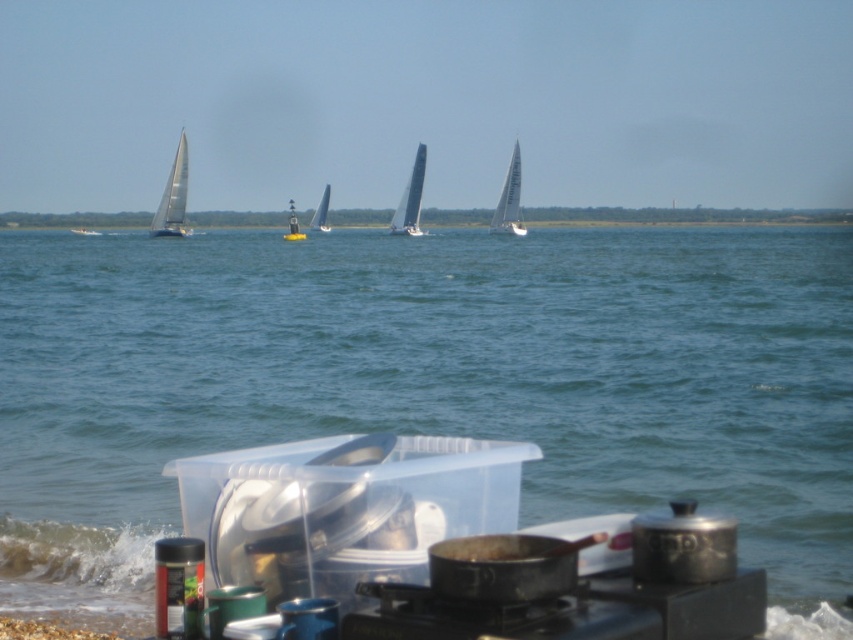
Question: Is black matte stove at lower center further to the viewer compared to white sailboat at left?

Choices:
 (A) no
 (B) yes

Answer: (A)

Question: Does white sail at left appear under white sail at center?

Choices:
 (A) no
 (B) yes

Answer: (B)

Question: Which object is the farthest from the white sail at left?

Choices:
 (A) blue water at center
 (B) black matte stove at lower center
 (C) white sailboat at left

Answer: (B)

Question: Which point is closer to the camera taking this photo?

Choices:
 (A) (90, 234)
 (B) (293, 221)
 (C) (724, 589)

Answer: (C)

Question: Considering the real-world distances, which object is closest to the black matte stove at lower center?

Choices:
 (A) white sail at center
 (B) blue water at center
 (C) clear plastic container at center
 (D) white sailboat at right

Answer: (C)

Question: Can you confirm if clear plastic container at center is smaller than white sail at left?

Choices:
 (A) yes
 (B) no

Answer: (A)